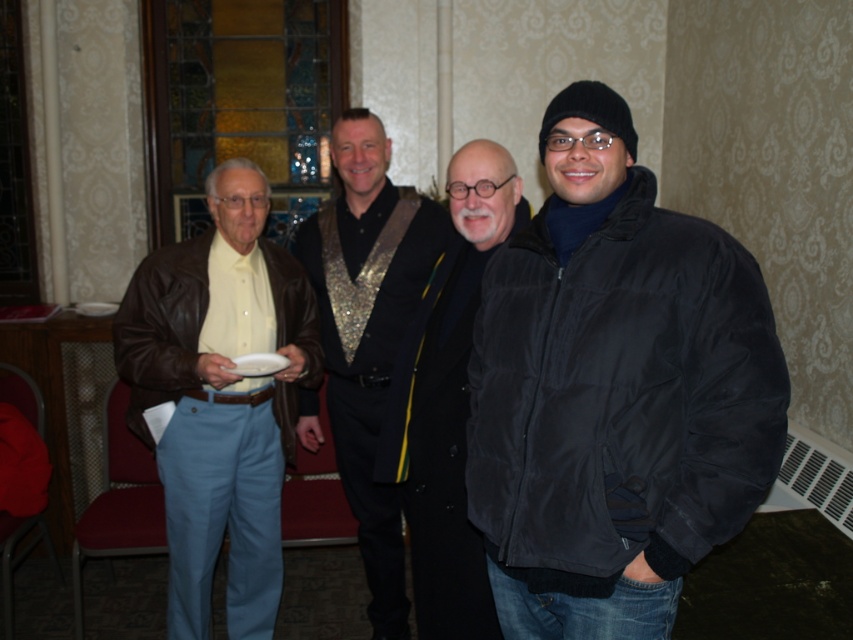
You are organizing a coat rack for an event and need to hang the black puffy jacket at right and the black matte jacket at center. Which jacket requires a wider hanger?

The black puffy jacket at right requires a wider hanger because its width is larger than the black matte jacket at center.